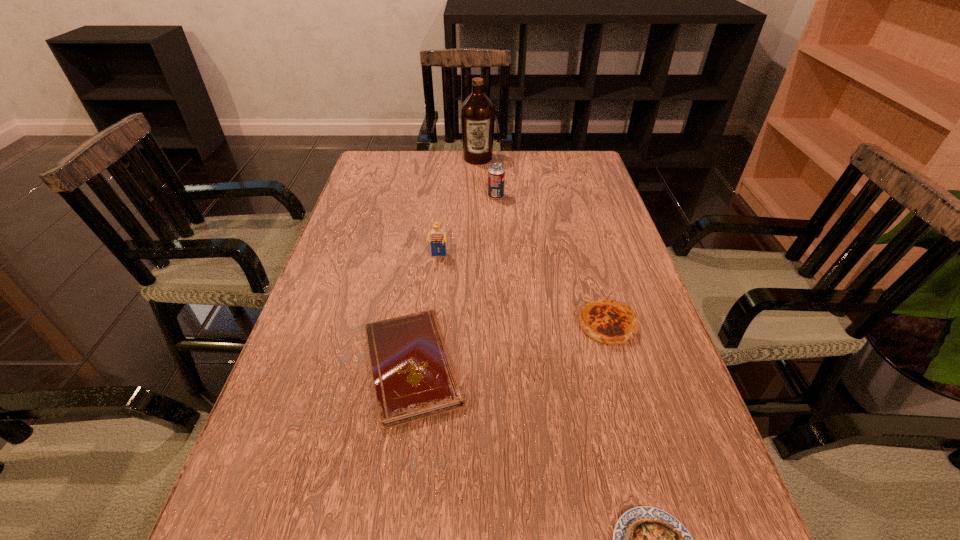
The height and width of the screenshot is (540, 960). Identify the location of free space between the notebook and the fifth nearest object. (454, 281).

Where is `free space between the third shortest object and the notebook`? This screenshot has height=540, width=960. free space between the third shortest object and the notebook is located at coordinates (510, 346).

At what (x,y) coordinates should I click in order to perform the action: click on free area in between the notebook and the olive oil. Please return your answer as a coordinate pair (x, y). Image resolution: width=960 pixels, height=540 pixels. Looking at the image, I should click on (445, 262).

This screenshot has width=960, height=540. Identify the location of object identified as the third closest to the beer can. (607, 321).

Locate which object is the fifth closest to the farthest object. Please provide its 2D coordinates. Your answer should be formatted as a tuple, i.e. [(x, y)], where the tuple contains the x and y coordinates of a point satisfying the conditions above.

[(646, 539)]

Identify which quiche is the second closest to the tallest object. Please provide its 2D coordinates. Your answer should be formatted as a tuple, i.e. [(x, y)], where the tuple contains the x and y coordinates of a point satisfying the conditions above.

[(646, 539)]

You are a GUI agent. You are given a task and a screenshot of the screen. Output one action in this format:
    pyautogui.click(x=<x>, y=<y>)
    Task: Click on the quiche that stands as the closest to the beer can
    This screenshot has width=960, height=540.
    Given the screenshot: What is the action you would take?
    pyautogui.click(x=607, y=321)

Identify the location of free space that satisfies the following two spatial constraints: 1. on the label of the fourth tallest object; 2. on the right side of the farthest object. (477, 325).

This screenshot has height=540, width=960. In order to click on free space that satisfies the following two spatial constraints: 1. on the label of the beer can; 2. on the right side of the tallest object in this screenshot , I will do `click(478, 197)`.